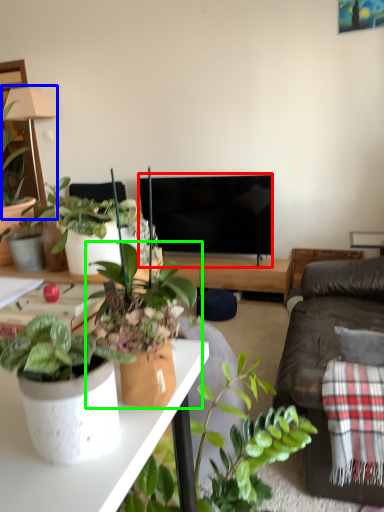
Question: Which object is positioned farthest from television (highlighted by a red box)? Select from lamp (highlighted by a blue box) and houseplant (highlighted by a green box).

Choices:
 (A) lamp
 (B) houseplant

Answer: (B)